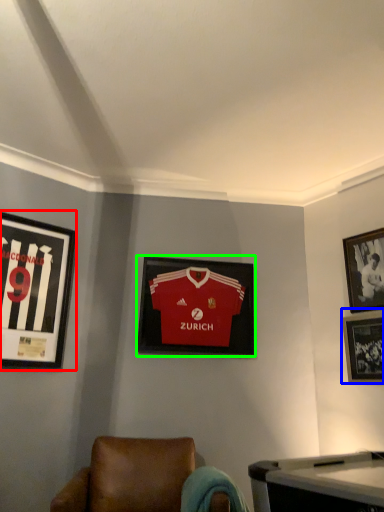
Question: Which object is the closest to the picture frame (highlighted by a red box)? Choose among these: picture frame (highlighted by a blue box) or picture frame (highlighted by a green box).

Choices:
 (A) picture frame
 (B) picture frame

Answer: (B)